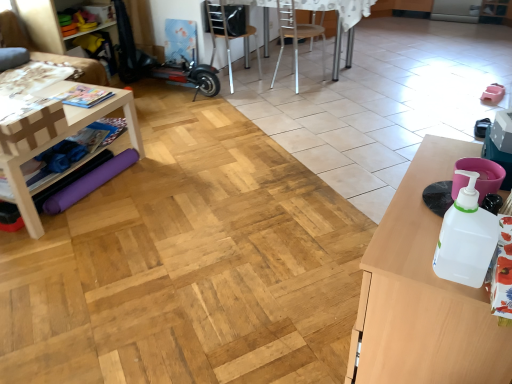
Find the location of `vacant region to the right of white wood table at left, placed as the second table when sorted from right to left`. vacant region to the right of white wood table at left, placed as the second table when sorted from right to left is located at coordinates (166, 187).